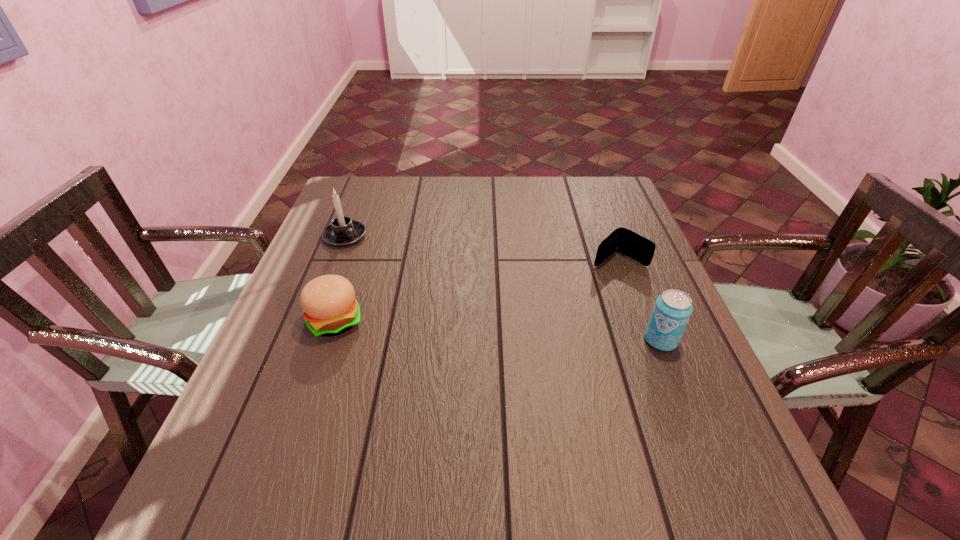
Identify the location of vacant space at the left edge of the desktop. This screenshot has width=960, height=540. (321, 253).

In the image, there is a desktop. In order to click on vacant space at the right edge in this screenshot , I will do `click(660, 273)`.

Identify the location of vacant space at the far left corner. (382, 206).

Find the location of a particular element. vacant space at the far right corner is located at coordinates (626, 201).

Identify the location of empty space that is in between the beer can and the candle holder. This screenshot has width=960, height=540. (503, 288).

This screenshot has width=960, height=540. In order to click on free spot between the hamburger and the beer can in this screenshot , I will do (x=498, y=330).

This screenshot has width=960, height=540. What are the coordinates of `free space that is in between the second farthest object and the hamburger` in the screenshot? It's located at tap(477, 291).

Where is `vacant area that lies between the farthest object and the wallet`? This screenshot has width=960, height=540. vacant area that lies between the farthest object and the wallet is located at coordinates (482, 248).

The image size is (960, 540). In order to click on free space between the third nearest object and the second shortest object in this screenshot , I will do `click(477, 291)`.

Locate an element on the screen. empty location between the second shortest object and the beer can is located at coordinates (498, 330).